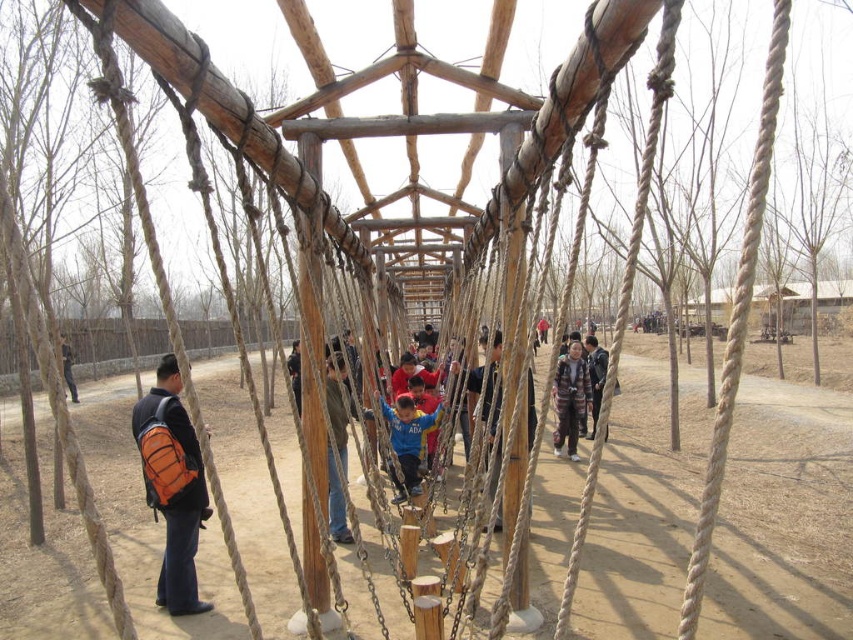
Is striped fabric jacket at center above orange backpack at left?

No, striped fabric jacket at center is not above orange backpack at left.

Based on the photo, can you confirm if striped fabric jacket at center is shorter than orange backpack at left?

Correct, striped fabric jacket at center is not as tall as orange backpack at left.

Which is behind, point (560, 424) or point (71, 355)?

The point (71, 355) is behind.

I want to click on striped fabric jacket at center, so (570, 397).

Can you confirm if blue matte shirt at center is positioned below camouflage jacket at center?

Yes.

Which is behind, point (389, 465) or point (592, 403)?

The point (592, 403) is more distant.

The height and width of the screenshot is (640, 853). Describe the element at coordinates (407, 442) in the screenshot. I see `blue matte shirt at center` at that location.

Where is `blue matte shirt at center`? blue matte shirt at center is located at coordinates (407, 442).

Does blue matte shirt at center have a lesser height compared to striped fabric jacket at center?

Yes.

Is point (409, 406) positioned before point (577, 348)?

Yes, point (409, 406) is closer to viewer.

At what (x,y) coordinates should I click in order to perform the action: click on blue matte shirt at center. Please return your answer as a coordinate pair (x, y). This screenshot has width=853, height=640. Looking at the image, I should click on (407, 442).

The image size is (853, 640). Identify the location of blue matte shirt at center. (407, 442).